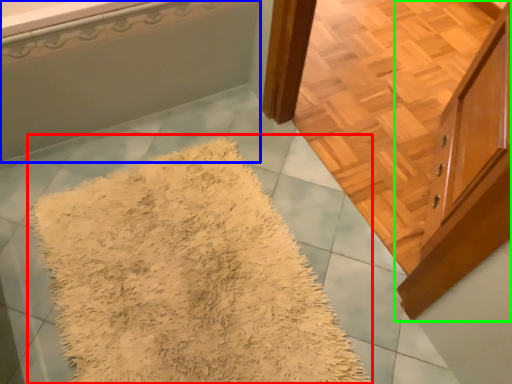
Question: Based on their relative distances, which object is nearer to mat (highlighted by a red box)? Choose from bathtub (highlighted by a blue box) and cabinetry (highlighted by a green box).

Choices:
 (A) bathtub
 (B) cabinetry

Answer: (A)